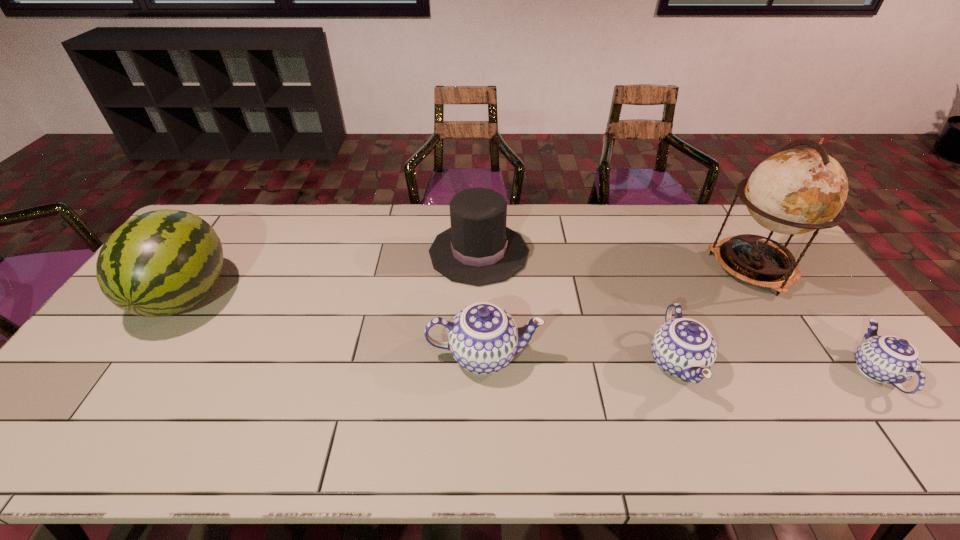
All chinawares are currently evenly spaced. To continue this pattern, where would you add another chinaware on the left? Please point out a vacant spot. Please provide its 2D coordinates. Your answer should be formatted as a tuple, i.e. [(x, y)], where the tuple contains the x and y coordinates of a point satisfying the conditions above.

[(297, 348)]